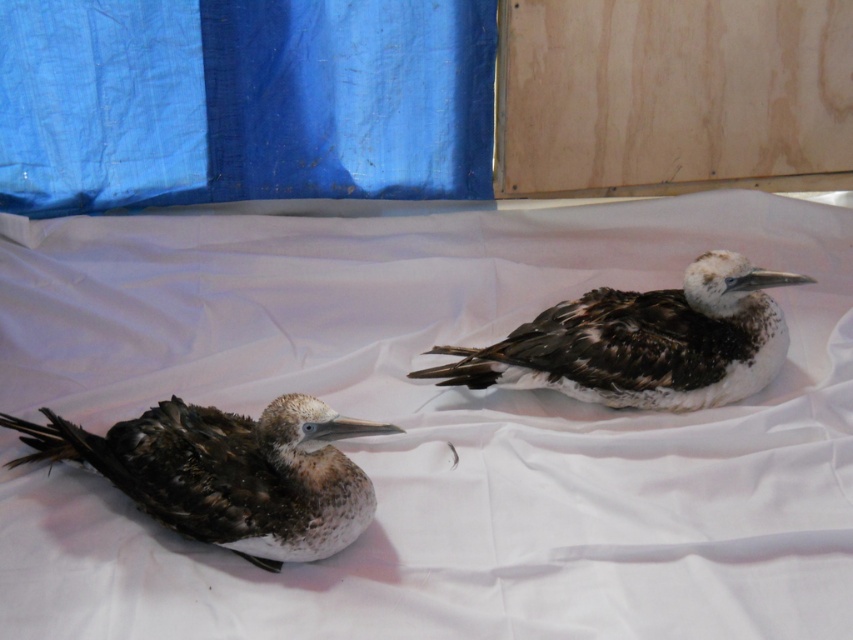
Question: Considering the relative positions of brown feathered bird at left and brown speckled feathers at center in the image provided, where is brown feathered bird at left located with respect to brown speckled feathers at center?

Choices:
 (A) right
 (B) left

Answer: (B)

Question: Which object is closer to the camera taking this photo?

Choices:
 (A) blue fabric curtain at upper left
 (B) brown speckled feathers at center
 (C) white fabric at center

Answer: (C)

Question: Among these objects, which one is nearest to the camera?

Choices:
 (A) brown speckled feathers at center
 (B) brown feathered bird at left
 (C) blue fabric curtain at upper left
 (D) white fabric at center

Answer: (D)

Question: Observing the image, what is the correct spatial positioning of white fabric at center in reference to brown feathered bird at left?

Choices:
 (A) left
 (B) right

Answer: (B)

Question: Which of the following is the farthest from the observer?

Choices:
 (A) blue fabric curtain at upper left
 (B) brown feathered bird at left
 (C) white fabric at center
 (D) brown speckled feathers at center

Answer: (A)

Question: Observing the image, what is the correct spatial positioning of blue fabric curtain at upper left in reference to brown speckled feathers at center?

Choices:
 (A) right
 (B) left

Answer: (B)